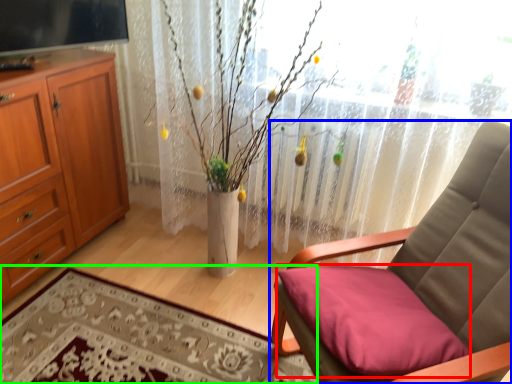
Question: Which object is positioned closest to pillow (highlighted by a red box)? Select from chair (highlighted by a blue box) and plain (highlighted by a green box).

Choices:
 (A) chair
 (B) plain

Answer: (A)